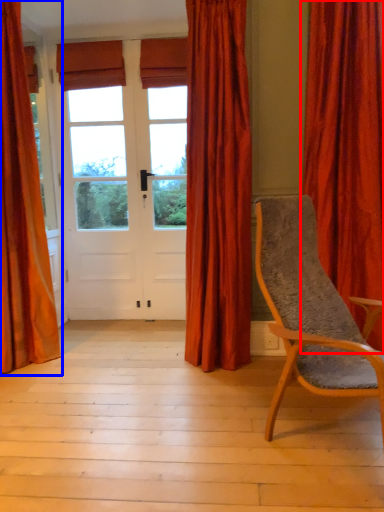
Question: Which object is further to the camera taking this photo, curtain (highlighted by a red box) or curtain (highlighted by a blue box)?

Choices:
 (A) curtain
 (B) curtain

Answer: (B)